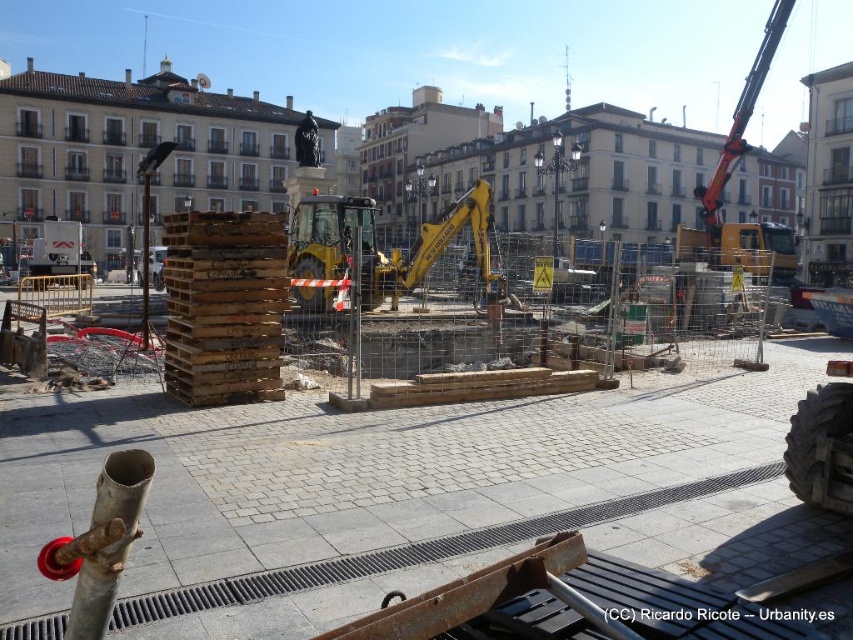
Which is in front, point (47, 516) or point (294, 131)?

Point (47, 516) is in front.

This screenshot has width=853, height=640. What are the coordinates of `wooden pallets at center` in the screenshot? It's located at (403, 493).

Describe the element at coordinates (393, 248) in the screenshot. I see `yellow metallic excavator at center` at that location.

Is yellow metallic excavator at center positioned in front of blacktexturedwebsite at center?

No, yellow metallic excavator at center is behind blacktexturedwebsite at center.

Is point (358, 234) positioned before point (701, 611)?

No, it is not.

This screenshot has height=640, width=853. I want to click on yellow metallic excavator at center, so click(x=393, y=248).

Between yellow metallic excavator at center and yellow metallic excavator at upper right, which one appears on the right side from the viewer's perspective?

yellow metallic excavator at upper right is more to the right.

Who is more distant from viewer, (395, 288) or (780, 248)?

The point (780, 248) is behind.

Image resolution: width=853 pixels, height=640 pixels. What do you see at coordinates (393, 248) in the screenshot?
I see `yellow metallic excavator at center` at bounding box center [393, 248].

The width and height of the screenshot is (853, 640). In order to click on yellow metallic excavator at center in this screenshot , I will do `click(393, 248)`.